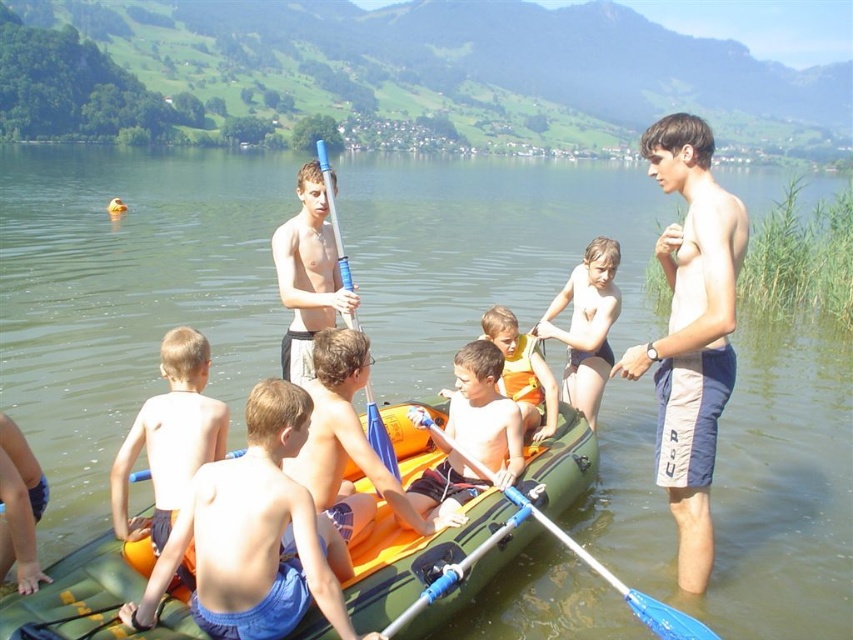
Which is below, orange rubber boat at center or matte blue paddle at center?

orange rubber boat at center is lower down.

Describe the element at coordinates (347, 444) in the screenshot. Image resolution: width=853 pixels, height=640 pixels. I see `orange rubber boat at center` at that location.

Is point (337, 438) in front of point (334, 177)?

That is True.

You are a GUI agent. You are given a task and a screenshot of the screen. Output one action in this format:
    pyautogui.click(x=<x>, y=<y>)
    Task: Click on the orange rubber boat at center
    The height and width of the screenshot is (640, 853).
    Given the screenshot: What is the action you would take?
    pyautogui.click(x=347, y=444)

Is point (141, 410) more distant than point (503, 392)?

No, it is in front of (503, 392).

How much distance is there between orange rubber kayak at lower left and orange fabric life vest at center?

orange rubber kayak at lower left and orange fabric life vest at center are 4.21 meters apart.

Is point (183, 440) closer to camera compared to point (521, 378)?

Yes, point (183, 440) is closer to viewer.

Where is `orange rubber kayak at lower left`? orange rubber kayak at lower left is located at coordinates click(170, 436).

Does matte black swimsuit at center appear over orange fabric life vest at center?

Yes.

Does matte black swimsuit at center have a greater height compared to orange fabric life vest at center?

Correct, matte black swimsuit at center is much taller as orange fabric life vest at center.

Which is behind, point (582, 324) or point (519, 385)?

The point (582, 324) is behind.

Identify the location of matte black swimsuit at center. The image size is (853, 640). (585, 324).